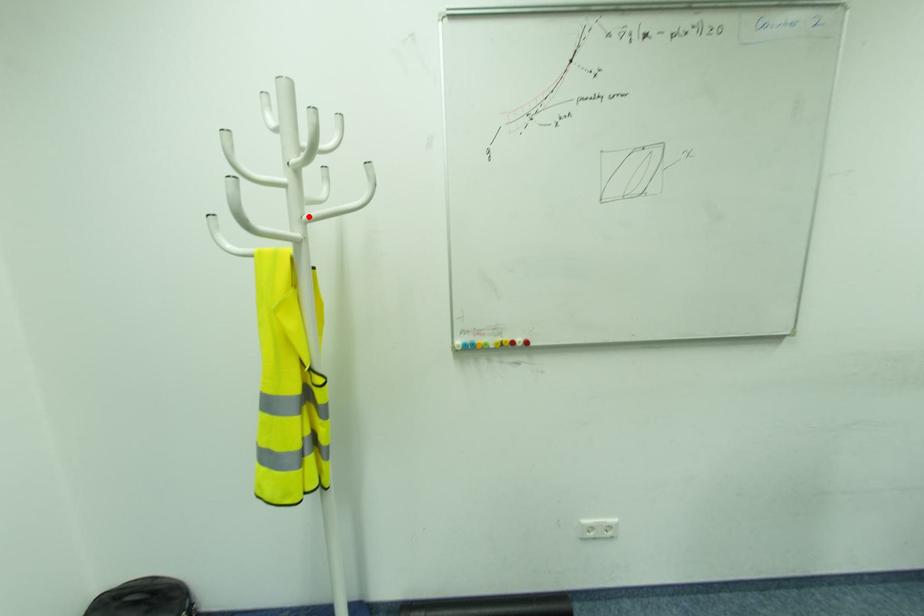
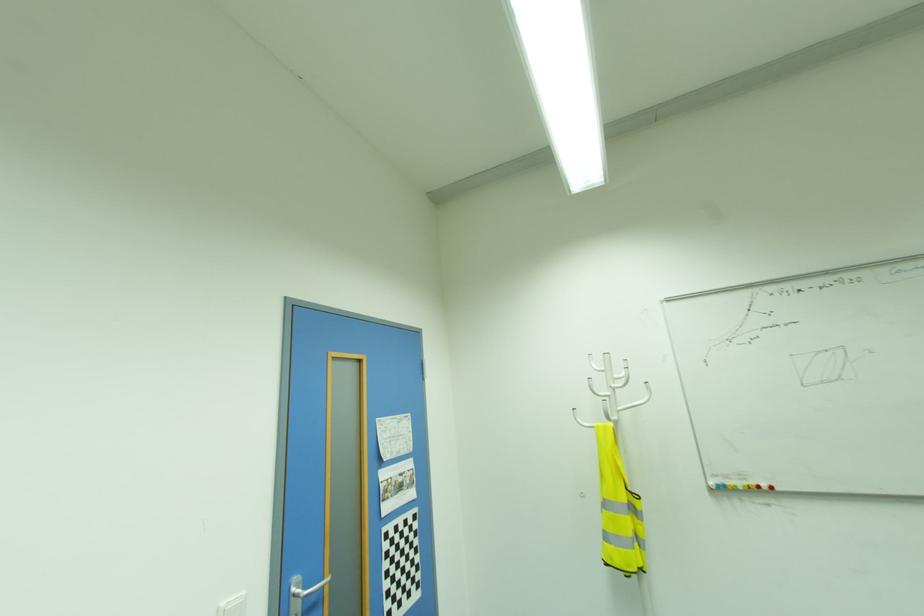
Where in the second image is the point corresponding to the highlighted location from the first image?

(622, 408)